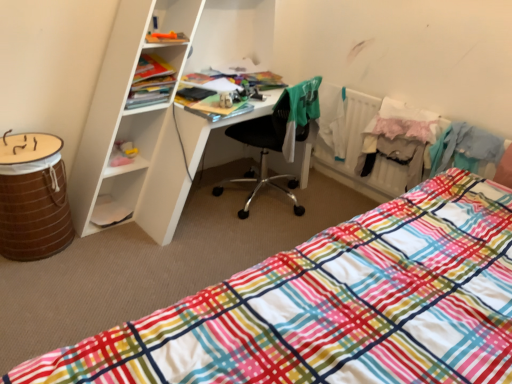
Locate an element on the screen. The width and height of the screenshot is (512, 384). vacant area to the right of brown woven barrel at lower left is located at coordinates (106, 252).